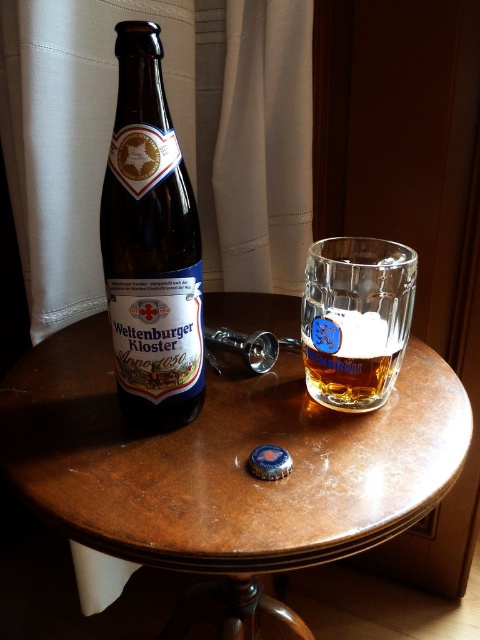
Does dark brown glass bottle at left appear over clear glass mug at center?

Yes, dark brown glass bottle at left is above clear glass mug at center.

Is dark brown glass bottle at left further to camera compared to clear glass mug at center?

No, dark brown glass bottle at left is closer to the viewer.

Where is `dark brown glass bottle at left`? This screenshot has width=480, height=640. dark brown glass bottle at left is located at coordinates (151, 244).

Can you confirm if brown wooden table at center is positioned to the left of dark brown glass bottle at left?

Incorrect, brown wooden table at center is not on the left side of dark brown glass bottle at left.

Who is more distant from viewer, (361, 456) or (164, 195)?

The point (361, 456) is more distant.

Find the location of a particular element. This screenshot has width=480, height=640. brown wooden table at center is located at coordinates (228, 465).

Is brown wooden table at center shorter than clear glass mug at center?

No.

Between brown wooden table at center and clear glass mug at center, which one has more height?

brown wooden table at center

Find the location of a particular element. brown wooden table at center is located at coordinates (228, 465).